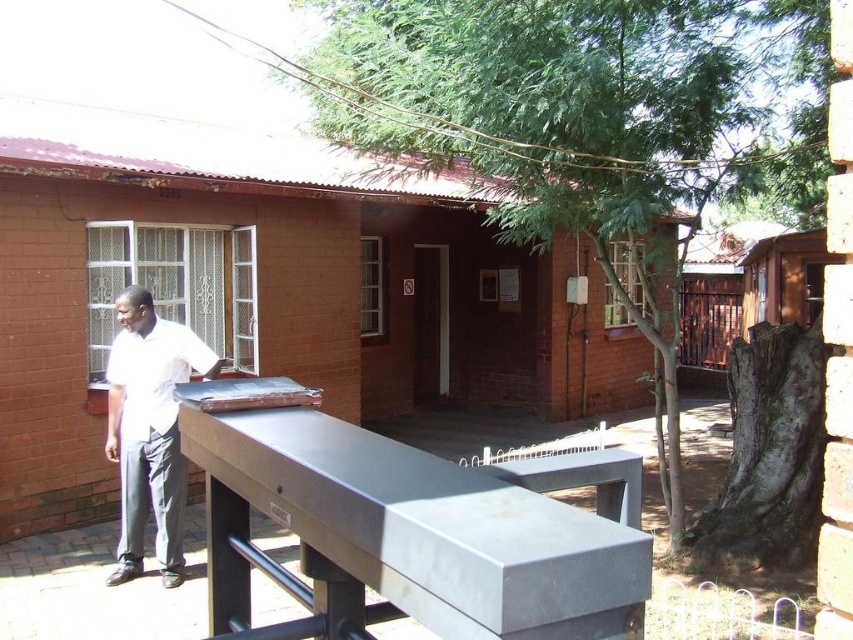
Is smooth gray picnic table at center closer to the viewer compared to metallic gray table tennis table at center?

Yes, it is.

The height and width of the screenshot is (640, 853). What do you see at coordinates (402, 538) in the screenshot? I see `smooth gray picnic table at center` at bounding box center [402, 538].

Who is more distant from viewer, (x=497, y=500) or (x=273, y=401)?

Positioned behind is point (x=273, y=401).

I want to click on smooth gray picnic table at center, so click(x=402, y=538).

Is white matte shirt at left positioned behind metallic gray table tennis table at center?

Yes, white matte shirt at left is behind metallic gray table tennis table at center.

I want to click on white matte shirt at left, so click(x=149, y=429).

Does smooth gray picnic table at center appear over white matte shirt at left?

Yes.

Is point (341, 580) behind point (160, 564)?

No, (341, 580) is in front of (160, 564).

Identify the location of smooth gray picnic table at center. (402, 538).